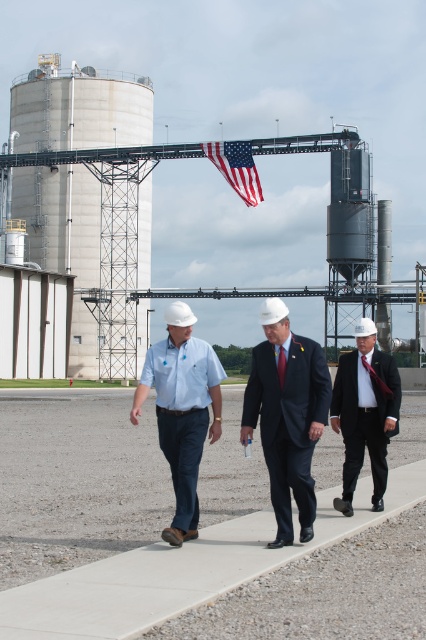
You are standing at the viewer position and want to place a 2 meter long safety barrier between yourself and the concrete at center. Is the distance sufficient for this placement?

The distance between the concrete at center and the viewer is 5.07 meters, which is more than enough to place a 2 meter long safety barrier between them.

You are a photographer positioned to the side of the pathway. You need to capture a photo where both the dark blue suit at center and the matte red tie at center are clearly visible. Considering their heights, which one might you need to adjust your camera angle to ensure both are in focus?

The dark blue suit at center is taller than the matte red tie at center, so you might need to lower your camera angle slightly to ensure both are in focus.

You are a photographer standing behind the three individuals. You need to take a photo that clearly shows both the dark blue suit at center and the dark red silk tie at center. Which object should you focus on to ensure both are in frame?

You should focus on the dark blue suit at center because it is much taller than the dark red silk tie at center, ensuring both will be visible in the photo.